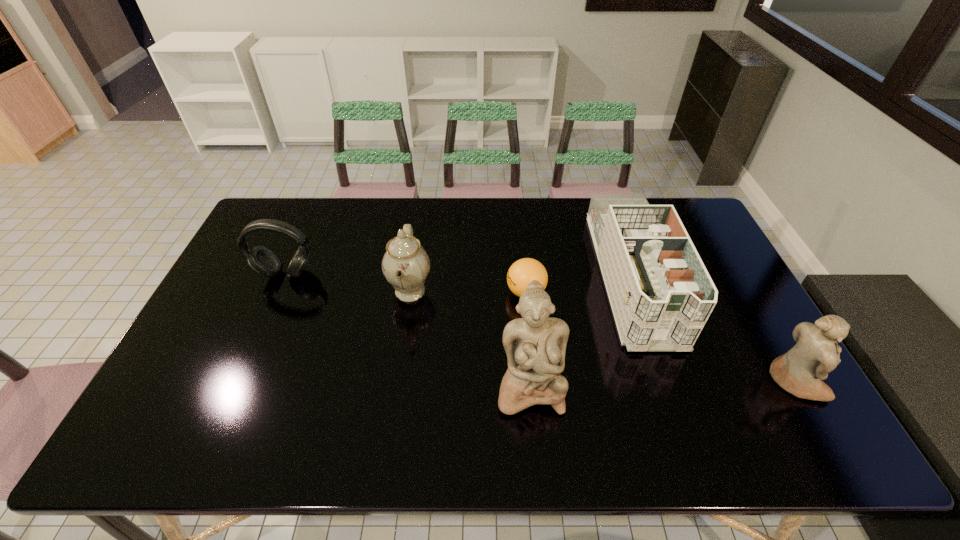
Find the location of a particular element. Image resolution: width=960 pixels, height=540 pixels. vacant space located on the spout of the chinaware is located at coordinates pyautogui.click(x=558, y=292).

Where is `vacant space located 0.400m on the side with brand of the shortest object`? This screenshot has width=960, height=540. vacant space located 0.400m on the side with brand of the shortest object is located at coordinates (374, 292).

The image size is (960, 540). In order to click on blank space located on the side with brand of the shortest object in this screenshot , I will do pos(397,292).

Find the location of a particular element. Image resolution: width=960 pixels, height=540 pixels. free location located 0.050m on the side with brand of the shortest object is located at coordinates (490, 292).

Where is `object situated at the far edge`? This screenshot has height=540, width=960. object situated at the far edge is located at coordinates (661, 294).

Find the location of a particular element. The width and height of the screenshot is (960, 540). object at the left edge is located at coordinates (261, 260).

Locate an element on the screen. object positioned at the right edge is located at coordinates (800, 371).

Locate an element on the screen. This screenshot has width=960, height=540. object that is at the near right corner is located at coordinates (800, 371).

At what (x,y) coordinates should I click in order to perform the action: click on vacant area at the far edge. Please return your answer as a coordinate pair (x, y). The height and width of the screenshot is (540, 960). Looking at the image, I should click on (423, 198).

At what (x,y) coordinates should I click in order to perform the action: click on blank space at the near edge. Please return your answer as a coordinate pair (x, y). The height and width of the screenshot is (540, 960). Looking at the image, I should click on (240, 399).